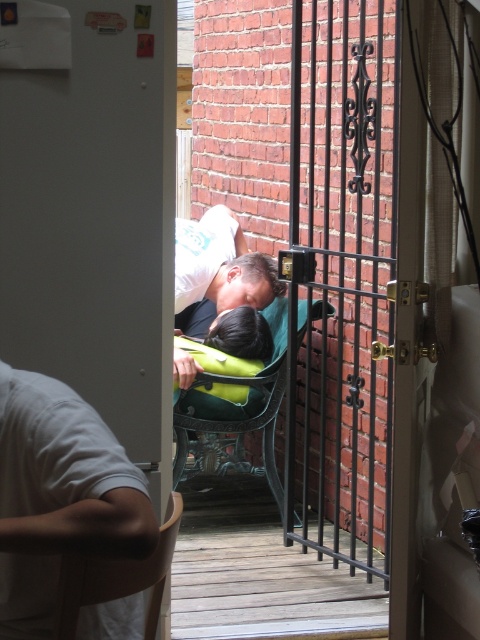
You are a delivery person trying to locate the correct entrance. You see the white matte door at upper left in the image. Based on its position, can you determine if it is the main entrance or a side entrance?

The white matte door at upper left is positioned at point (96, 221), which typically corresponds to a side entrance rather than the main entrance in such architectural layouts.

You are standing inside the house looking through the doorway. You see a matte green backpack at center and a wooden chair at lower left. Which object is closer to the door frame?

The wooden chair at lower left is closer to the door frame because it is positioned to the left of the matte green backpack at center, which is further away.